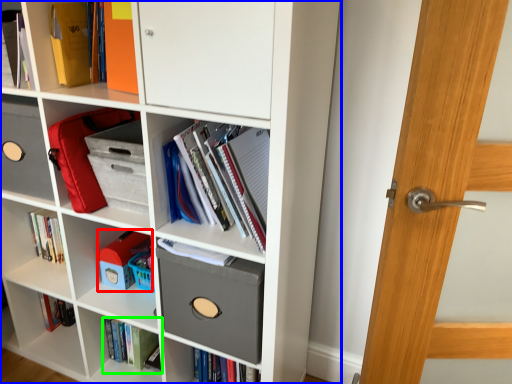
Question: Which object is the closest to the toy (highlighted by a red box)? Choose among these: bookcase (highlighted by a blue box) or book (highlighted by a green box).

Choices:
 (A) bookcase
 (B) book

Answer: (B)